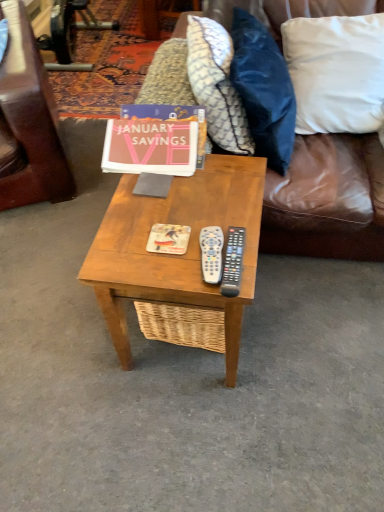
Where is `free space on the front side of brown leather couch at upper right`? free space on the front side of brown leather couch at upper right is located at coordinates [260, 378].